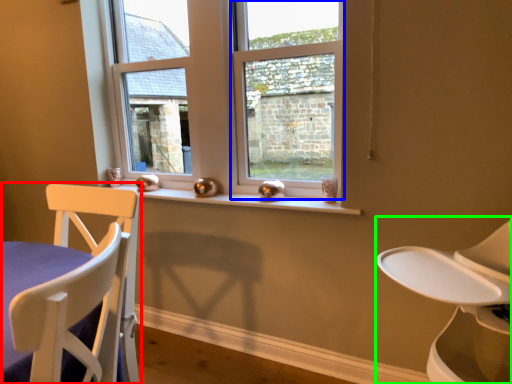
Question: Which is farther away from chair (highlighted by a red box)? window (highlighted by a blue box) or feeding chair (highlighted by a green box)?

Choices:
 (A) window
 (B) feeding chair

Answer: (A)